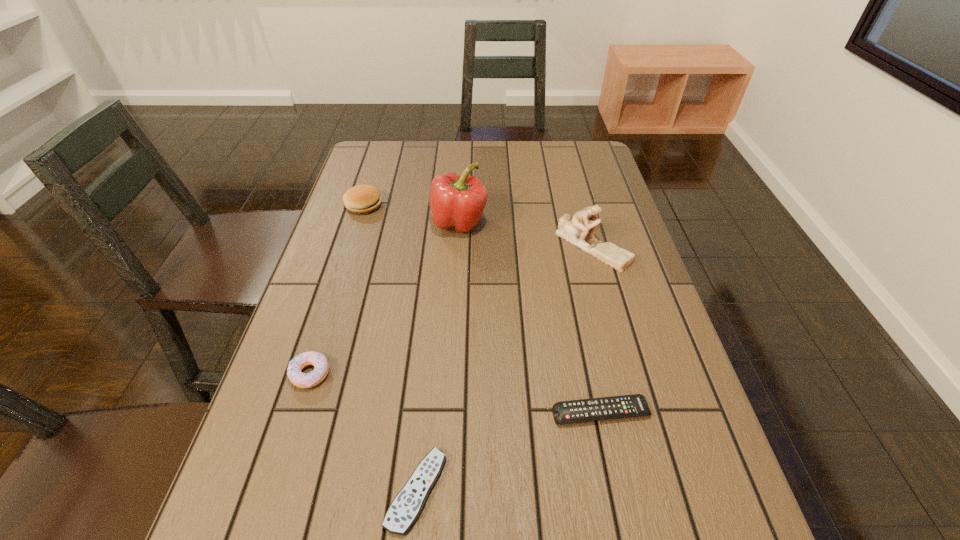
Identify the location of the tallest object. The height and width of the screenshot is (540, 960). (456, 201).

Image resolution: width=960 pixels, height=540 pixels. Identify the location of the fifth shortest object. (575, 230).

Identify the location of the fourth shortest object. (361, 199).

You are a GUI agent. You are given a task and a screenshot of the screen. Output one action in this format:
    pyautogui.click(x=<x>, y=<y>)
    Task: Click on the fourth tallest object
    
    Given the screenshot: What is the action you would take?
    pyautogui.click(x=302, y=380)

Locate an element on the screen. the fourth farthest object is located at coordinates pyautogui.click(x=302, y=380).

At what (x,y) coordinates should I click in order to perform the action: click on the farther remote control. Please return your answer as a coordinate pair (x, y). This screenshot has width=960, height=540. Looking at the image, I should click on (574, 411).

You are a GUI agent. You are given a task and a screenshot of the screen. Output one action in this format:
    pyautogui.click(x=<x>, y=<y>)
    Task: Click on the right remote control
    The width and height of the screenshot is (960, 540).
    Given the screenshot: What is the action you would take?
    pyautogui.click(x=574, y=411)

Identify the location of the nearest object. The height and width of the screenshot is (540, 960). (406, 507).

The height and width of the screenshot is (540, 960). What are the coordinates of `the nearer remote control` in the screenshot? It's located at (406, 507).

Locate an element on the screen. This screenshot has width=960, height=540. free space located on the right of the tallest object is located at coordinates (606, 222).